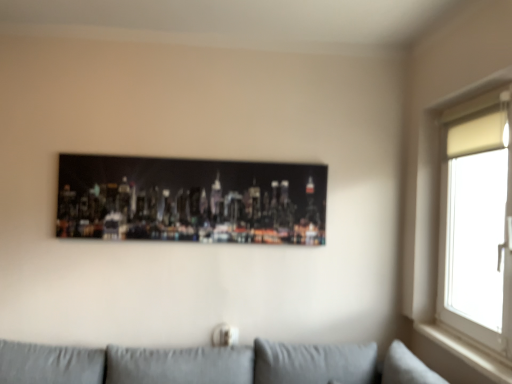
Question: Is white matte window at upper right shorter than white wood window sill at right?

Choices:
 (A) yes
 (B) no

Answer: (B)

Question: Is white matte window at upper right oriented towards white wood window sill at right?

Choices:
 (A) no
 (B) yes

Answer: (A)

Question: Is white matte window at upper right turned away from white wood window sill at right?

Choices:
 (A) yes
 (B) no

Answer: (B)

Question: Can you confirm if white matte window at upper right is positioned to the left of white wood window sill at right?

Choices:
 (A) no
 (B) yes

Answer: (A)

Question: Is white matte window at upper right closer to camera compared to white wood window sill at right?

Choices:
 (A) yes
 (B) no

Answer: (A)

Question: Considering the relative sizes of white matte window at upper right and white wood window sill at right in the image provided, is white matte window at upper right thinner than white wood window sill at right?

Choices:
 (A) no
 (B) yes

Answer: (A)

Question: Could you tell me if metallic cityscape print at center is turned towards white wood window sill at right?

Choices:
 (A) yes
 (B) no

Answer: (B)

Question: Would you say metallic cityscape print at center is outside white wood window sill at right?

Choices:
 (A) no
 (B) yes

Answer: (B)

Question: From a real-world perspective, is metallic cityscape print at center physically above white wood window sill at right?

Choices:
 (A) no
 (B) yes

Answer: (B)

Question: Can you confirm if metallic cityscape print at center is positioned to the right of white wood window sill at right?

Choices:
 (A) yes
 (B) no

Answer: (B)

Question: From the image's perspective, would you say metallic cityscape print at center is shown under white wood window sill at right?

Choices:
 (A) yes
 (B) no

Answer: (B)

Question: Does metallic cityscape print at center appear on the left side of white wood window sill at right?

Choices:
 (A) no
 (B) yes

Answer: (B)

Question: Is metallic cityscape print at center bigger than white matte window at upper right?

Choices:
 (A) yes
 (B) no

Answer: (B)